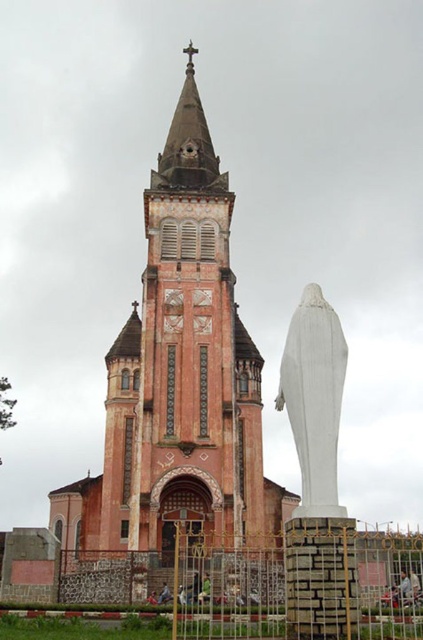
You are an architect visiting the church and need to determine which object is bigger between the pink stone tower at center and the white marble statue at center. Based on the scene, which one is larger?

The pink stone tower at center has a larger size compared to the white marble statue at center, so the pink stone tower at center is bigger.

You are a photographer planning to capture the pink stone tower at center and the white marble statue at center in a single frame. Based on their sizes, which object would appear larger in the photo?

The pink stone tower at center might appear larger in the photo than the white marble statue at center because the pink stone tower at center might be wider than white marble statue at center.

You are standing at the point marked as point (173,396) in the image. What structure are you currently standing on?

You are standing on the pink stone tower at center.